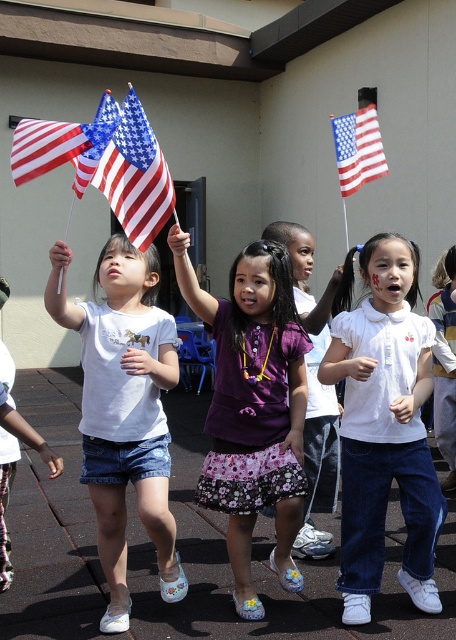
Question: Can you confirm if white matte t-shirt at center is smaller than purple satin dress at center?

Choices:
 (A) yes
 (B) no

Answer: (B)

Question: Considering the real-world distances, which object is farthest from the purple satin dress at center?

Choices:
 (A) american flag at left
 (B) matte fabric flag at upper left

Answer: (A)

Question: Which of the following is the farthest from the observer?

Choices:
 (A) (327, 509)
 (B) (88, 134)
 (C) (98, 362)

Answer: (A)

Question: Observing the image, what is the correct spatial positioning of white matte t-shirt at center in reference to purple satin dress at center?

Choices:
 (A) left
 (B) right

Answer: (A)

Question: Observing the image, what is the correct spatial positioning of american flag at upper center in reference to american flag at left?

Choices:
 (A) right
 (B) left

Answer: (A)

Question: Based on their relative distances, which object is farther from the white matte t-shirt at center?

Choices:
 (A) american flag at upper center
 (B) american flag at left

Answer: (A)